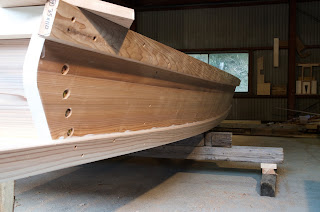
Locate an element on the screen. Image resolution: width=320 pixels, height=212 pixels. dark wood block on right side of floor is located at coordinates (265, 187).